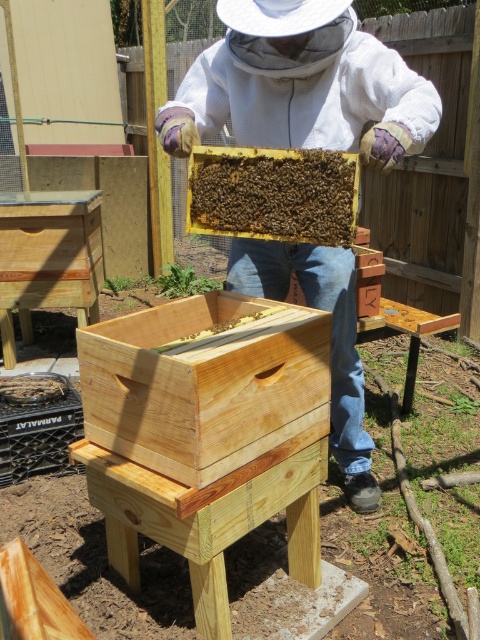
You are a beekeeper who needs to place the brown wooden bee at center on top of the brown wooden beehive at center. Can you do this without the bee falling off?

The brown wooden beehive at center is taller than the brown wooden bee at center, so placing the brown wooden bee at center on top of the brown wooden beehive at center would require ensuring it is stable. However, since the bee is smaller in height, it might fit, but stability depends on the surface area and balance. Without additional details on the base, it is uncertain. However, based on height alone, the bee can be placed on top as the hive is taller, but practical stability cannot be confirmed here.

What is located at the coordinates point (300, 84) in the image?

The white fabric beekeeper suit at center is located at point (300, 84).

You are a photographer trying to capture a closeup of the brown wooden beehive at center without including the white fabric beekeeper suit at center in the frame. Given their relative sizes, do you think this is possible?

The white fabric beekeeper suit at center is wider than the brown wooden beehive at center, so it might be challenging to frame the beehive without including the suit if they are positioned centrally. Adjust your angle or distance to isolate the beehive.